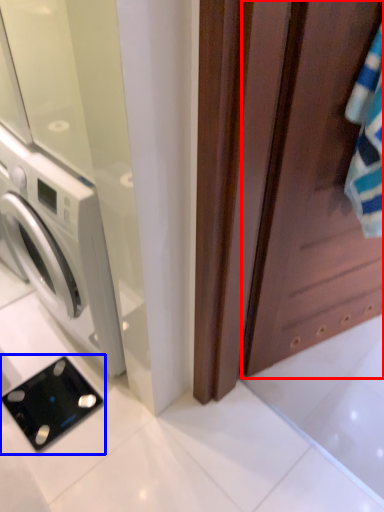
Question: Which point is further to the camera, screen door (highlighted by a red box) or appliance (highlighted by a blue box)?

Choices:
 (A) screen door
 (B) appliance

Answer: (B)